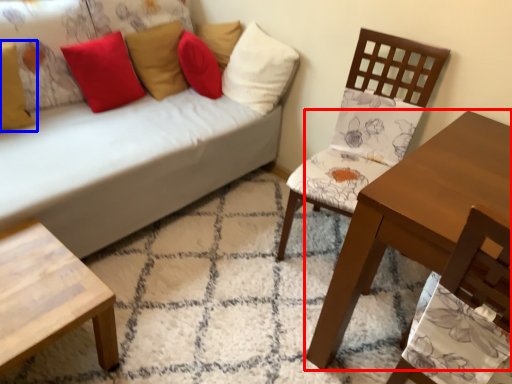
Question: Which point is further to the camera, table (highlighted by a red box) or pillow (highlighted by a blue box)?

Choices:
 (A) table
 (B) pillow

Answer: (B)